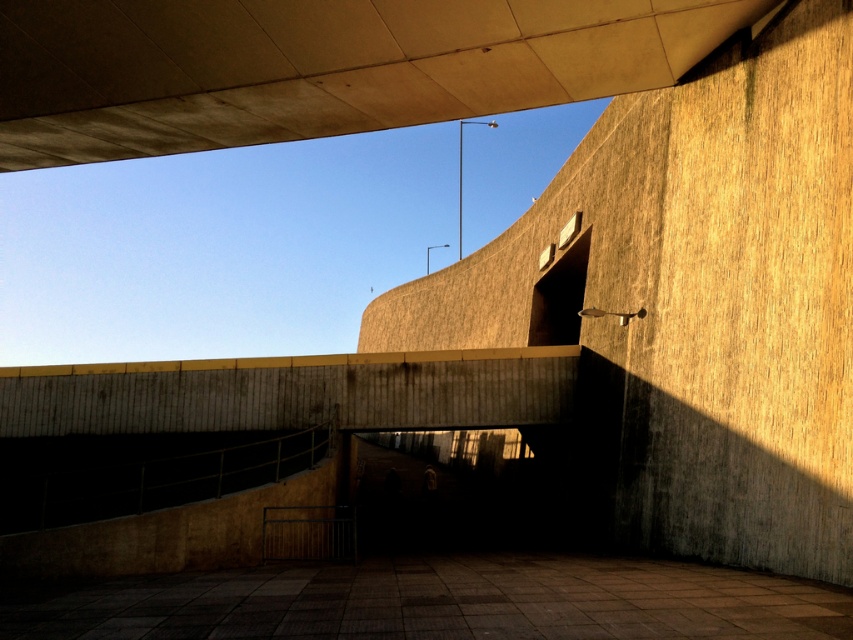
Question: Is concrete ceiling at upper center below brown concrete at center?

Choices:
 (A) yes
 (B) no

Answer: (B)

Question: Is concrete ceiling at upper center wider than brown concrete at center?

Choices:
 (A) no
 (B) yes

Answer: (B)

Question: Which of the following is the farthest from the observer?

Choices:
 (A) concrete ceiling at upper center
 (B) brown concrete at center

Answer: (A)

Question: Does concrete ceiling at upper center appear on the left side of brown concrete at center?

Choices:
 (A) no
 (B) yes

Answer: (B)